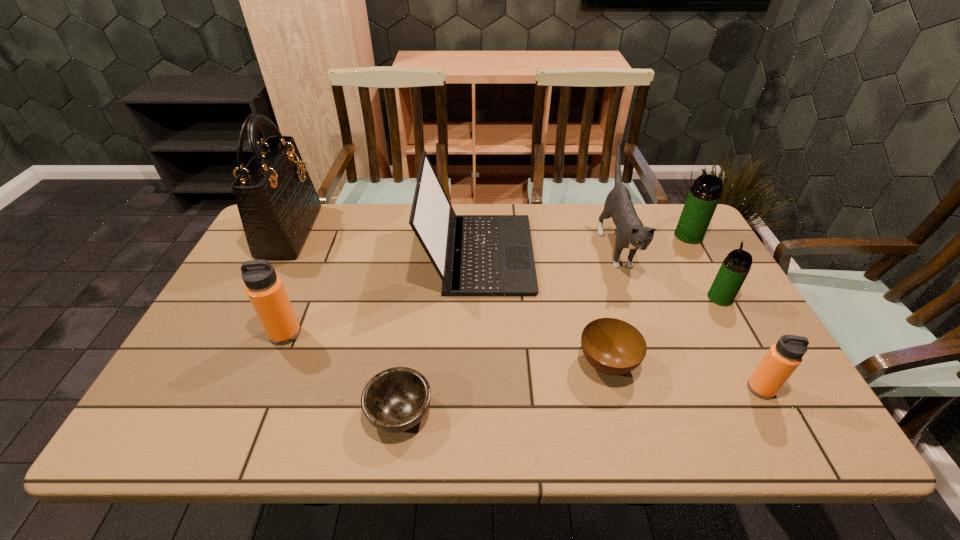
In order to click on cat that is at the far edge in this screenshot , I will do `click(631, 233)`.

The image size is (960, 540). I want to click on laptop present at the far edge, so click(x=475, y=255).

Where is `thermos bottle that is positioned at the far edge`? This screenshot has width=960, height=540. thermos bottle that is positioned at the far edge is located at coordinates (704, 195).

This screenshot has width=960, height=540. What are the coordinates of `object present at the near edge` in the screenshot? It's located at (396, 399).

The width and height of the screenshot is (960, 540). In order to click on object present at the left edge in this screenshot , I will do `click(277, 202)`.

Locate an element on the screen. The width and height of the screenshot is (960, 540). object present at the far left corner is located at coordinates (277, 202).

Locate an element on the screen. This screenshot has width=960, height=540. object located in the far right corner section of the desktop is located at coordinates (704, 195).

Find the location of a particular element. This screenshot has height=540, width=960. vacant space at the far edge of the desktop is located at coordinates (555, 228).

What are the coordinates of `vacant region at the near edge of the desktop` in the screenshot? It's located at (658, 407).

Image resolution: width=960 pixels, height=540 pixels. In order to click on vacant space at the left edge in this screenshot , I will do `click(242, 262)`.